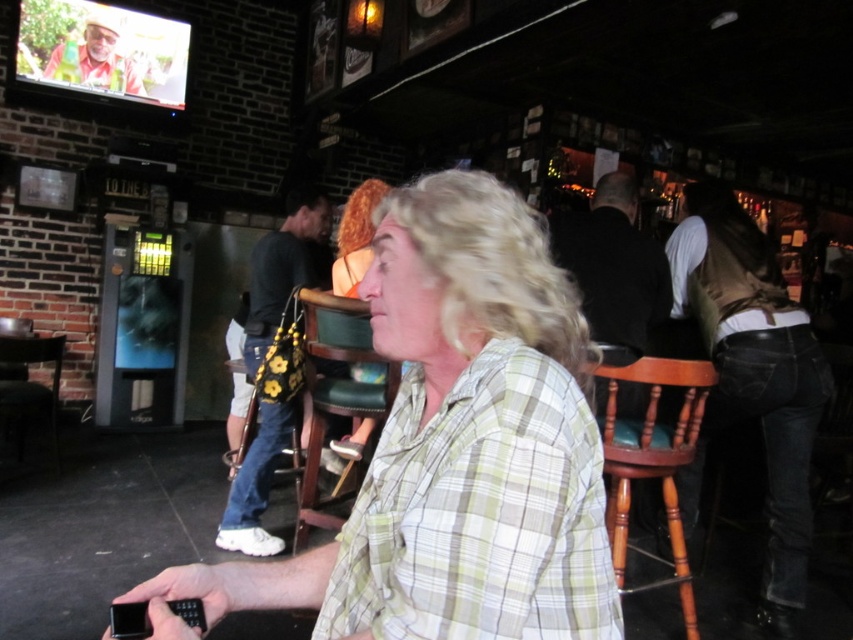
Question: Is green plaid shirt at center behind matte orange shirt at upper left?

Choices:
 (A) yes
 (B) no

Answer: (B)

Question: Which is nearer to the black leather jacket at upper center?

Choices:
 (A) matte orange shirt at upper left
 (B) denim jeans at right
 (C) floral-patterned fabric bag at center

Answer: (B)

Question: Which object is positioned farthest from the black leather jacket at upper center?

Choices:
 (A) denim jeans at right
 (B) matte orange shirt at upper left
 (C) matte brown leather purse at center

Answer: (B)

Question: Is denim jeans at right below matte orange shirt at upper left?

Choices:
 (A) yes
 (B) no

Answer: (A)

Question: Among these points, which one is nearest to the camera?

Choices:
 (A) (689, 204)
 (B) (299, 227)

Answer: (A)

Question: Is denim jeans at right behind matte orange shirt at upper left?

Choices:
 (A) yes
 (B) no

Answer: (B)